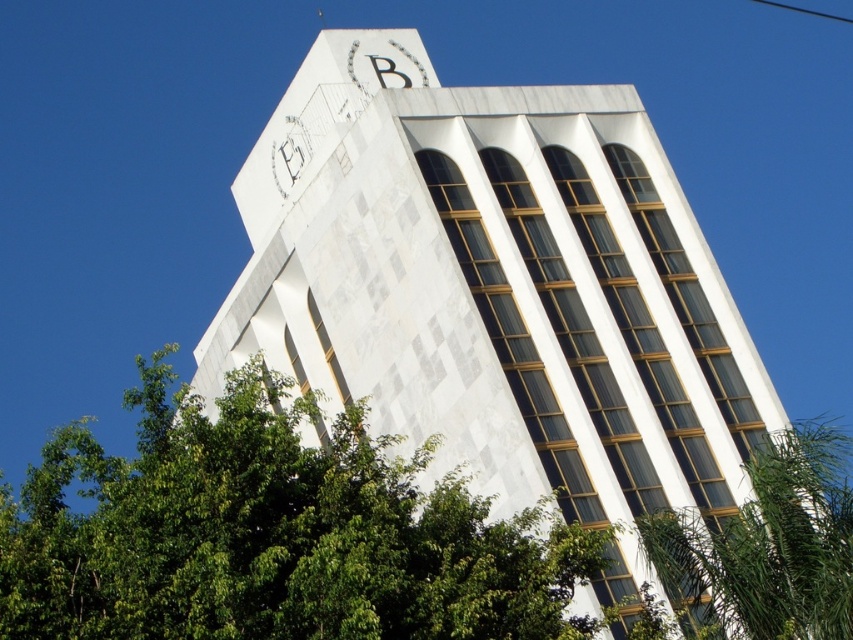
Does white marble tower at center have a lesser height compared to green leafy tree at lower right?

Incorrect, white marble tower at center's height does not fall short of green leafy tree at lower right's.

How much distance is there between white marble tower at center and green leafy tree at lower right?

white marble tower at center is 17.55 meters from green leafy tree at lower right.

This screenshot has width=853, height=640. What do you see at coordinates (495, 285) in the screenshot? I see `white marble tower at center` at bounding box center [495, 285].

Locate an element on the screen. white marble tower at center is located at coordinates (495, 285).

Is white marble tower at center to the right of green leafy tree at lower left from the viewer's perspective?

Correct, you'll find white marble tower at center to the right of green leafy tree at lower left.

Which is below, white marble tower at center or green leafy tree at lower left?

Positioned lower is green leafy tree at lower left.

Is point (461, 145) positioned after point (112, 538)?

That is True.

Locate an element on the screen. The height and width of the screenshot is (640, 853). white marble tower at center is located at coordinates (495, 285).

Between green leafy tree at lower right and white marble clock at upper center, which one is positioned lower?

green leafy tree at lower right is below.

Find the location of a particular element. This screenshot has height=640, width=853. green leafy tree at lower right is located at coordinates (766, 547).